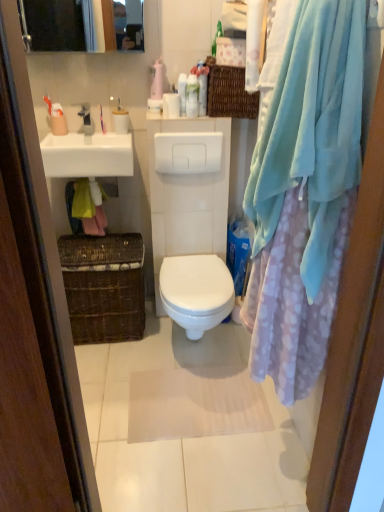
Identify the location of free space on the front side of matte plastic toothbrush at upper left, which appears as the sixth toiletry when viewed from the right. (71, 141).